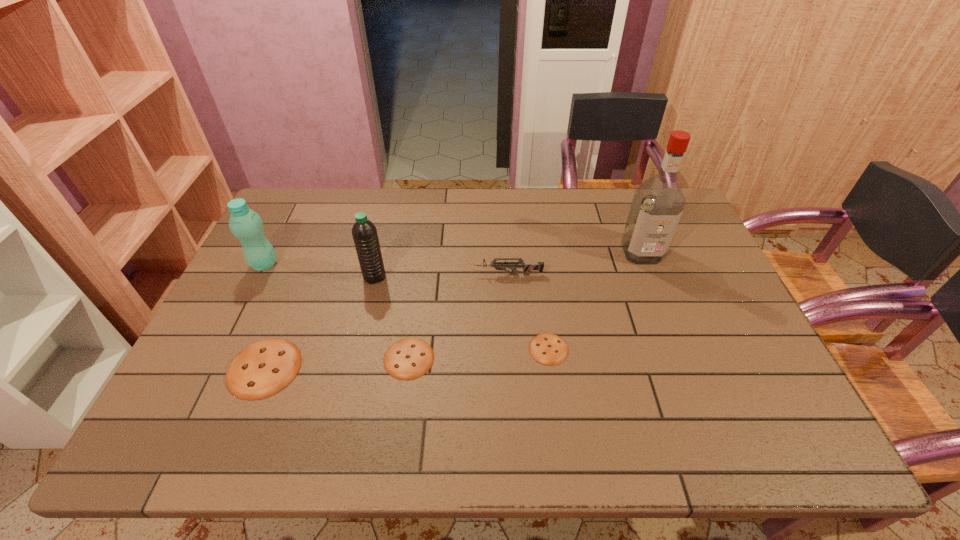
Identify the location of cookie that is at the left edge. (264, 368).

In order to click on bottle located at the left edge in this screenshot , I will do `click(246, 225)`.

Identify the location of object present at the right edge. [658, 203].

At what (x,y) coordinates should I click in order to perform the action: click on object that is at the near left corner. Please return your answer as a coordinate pair (x, y). This screenshot has width=960, height=540. Looking at the image, I should click on (264, 368).

Find the location of a particular element. Image resolution: width=960 pixels, height=540 pixels. free spot at the far edge of the desktop is located at coordinates (x=516, y=190).

This screenshot has height=540, width=960. In order to click on vacant area at the near edge of the desktop in this screenshot , I will do `click(460, 381)`.

You are a GUI agent. You are given a task and a screenshot of the screen. Output one action in this format:
    pyautogui.click(x=<x>, y=<y>)
    Task: Click on the free region at the left edge
    The image size is (960, 540).
    Given the screenshot: What is the action you would take?
    pyautogui.click(x=218, y=358)

Where is `vacant space at the right edge of the desktop`? The height and width of the screenshot is (540, 960). vacant space at the right edge of the desktop is located at coordinates (689, 318).

At what (x,y) coordinates should I click in order to perform the action: click on vacant space at the far left corner of the desktop. Please return your answer as a coordinate pair (x, y). The width and height of the screenshot is (960, 540). Looking at the image, I should click on pyautogui.click(x=324, y=200).

Identify the location of blank region between the water bottle and the bottle. The height and width of the screenshot is (540, 960). (320, 271).